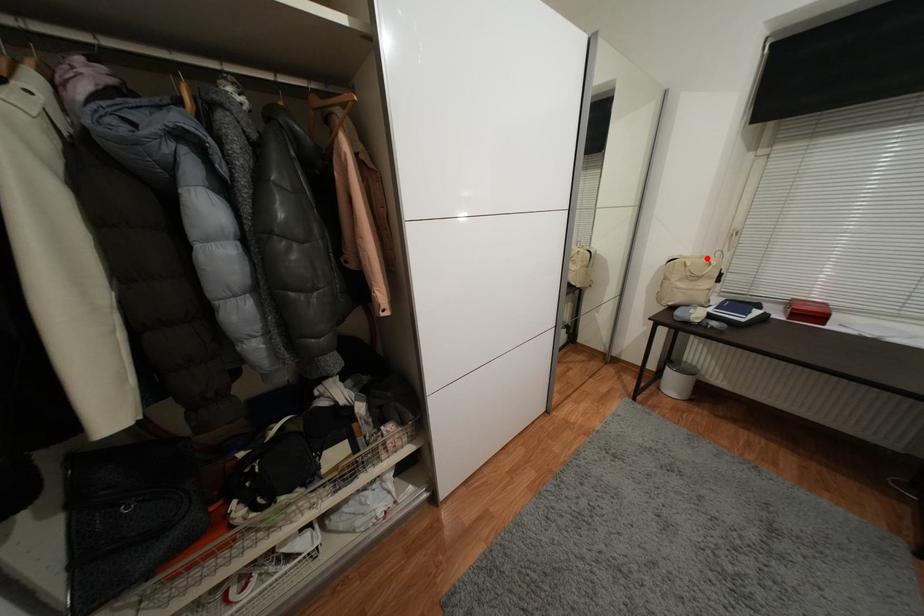
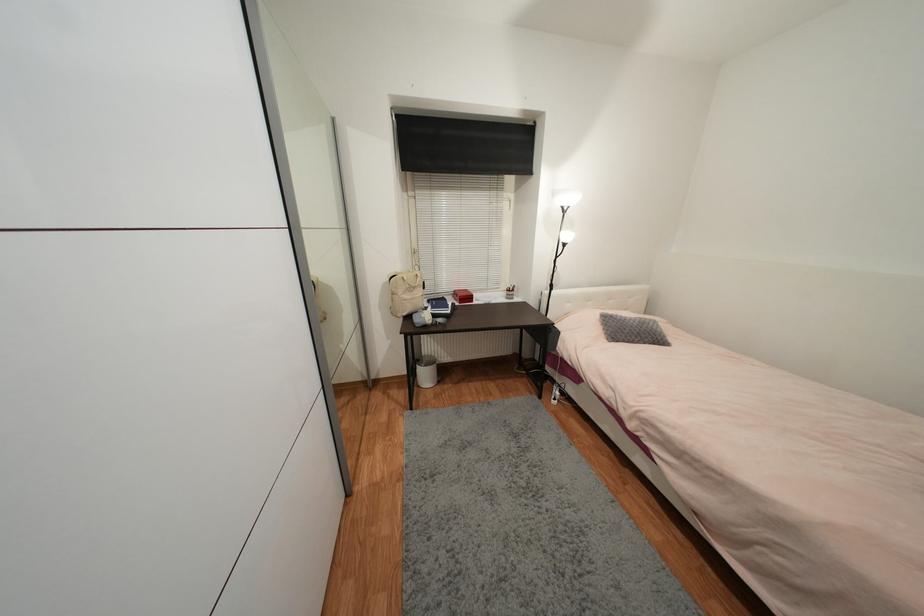
The point at the highlighted location is marked in the first image. Where is the corresponding point in the second image?

(412, 273)